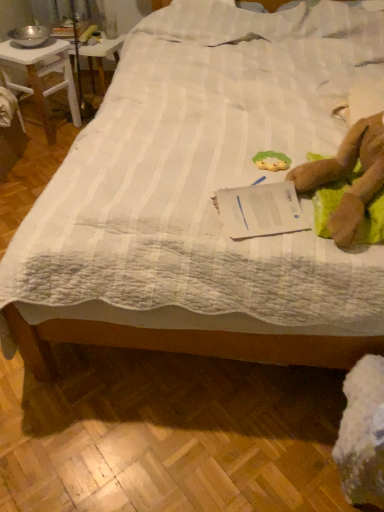
What are the coordinates of `metallic silver bowl at upper left` in the screenshot? It's located at (95, 58).

Find the location of a particular element. Image resolution: width=384 pixels, height=512 pixels. green fabric toy at center is located at coordinates (272, 161).

Find the location of a particular element. The height and width of the screenshot is (512, 384). white wood desk at upper left is located at coordinates (41, 77).

Consider the image. How different are the orientations of white paper at center and white quilted bed at center in degrees?

The angular difference between white paper at center and white quilted bed at center is 69 degrees.

From the image's perspective, which is below, white paper at center or white quilted bed at center?

white paper at center, from the image's perspective.

Is white paper at center completely or partially outside of white quilted bed at center?

No, most part of white paper at center lies within white quilted bed at center.

Considering the positions of objects white paper at center and white quilted bed at center in the image provided, who is more to the left, white paper at center or white quilted bed at center?

From the viewer's perspective, white paper at center appears more on the left side.

From a real-world perspective, which is physically above, white wood desk at upper left or white paper at center?

white paper at center is physically above.

Which of these two, white wood desk at upper left or white paper at center, is bigger?

white wood desk at upper left.

Is white wood desk at upper left at the left side of white paper at center?

Indeed, white wood desk at upper left is positioned on the left side of white paper at center.

Is point (50, 136) positioned after point (230, 237)?

Yes, point (50, 136) is behind point (230, 237).

Is metallic silver bowl at upper left shorter than white quilted bed at center?

Correct, metallic silver bowl at upper left is not as tall as white quilted bed at center.

In the scene shown: Is metallic silver bowl at upper left bigger or smaller than white quilted bed at center?

metallic silver bowl at upper left is smaller than white quilted bed at center.

Which is correct: metallic silver bowl at upper left is inside white quilted bed at center, or outside of it?

metallic silver bowl at upper left is located beyond the bounds of white quilted bed at center.

Find the location of `bed in front of the metallic silver bowl at upper left`. bed in front of the metallic silver bowl at upper left is located at coordinates (200, 199).

Considering the sizes of brown plush toy at right and white paper at center in the image, is brown plush toy at right bigger or smaller than white paper at center?

brown plush toy at right is bigger than white paper at center.

Is brown plush toy at right facing towards white paper at center?

No, brown plush toy at right is not oriented towards white paper at center.

Based on their sizes in the image, would you say white paper at center is bigger or smaller than metallic silver bowl at upper left?

Considering their sizes, white paper at center takes up less space than metallic silver bowl at upper left.

Is white paper at center closer to camera compared to metallic silver bowl at upper left?

Yes, it is.

Is white paper at center taller than metallic silver bowl at upper left?

No.

Would you consider white paper at center to be distant from metallic silver bowl at upper left?

Yes.

Is metallic silver bowl at upper left directly adjacent to green fabric toy at center?

No.

The height and width of the screenshot is (512, 384). I want to click on toy in front of the metallic silver bowl at upper left, so click(272, 161).

Considering the positions of objects metallic silver bowl at upper left and green fabric toy at center in the image provided, who is behind, metallic silver bowl at upper left or green fabric toy at center?

metallic silver bowl at upper left is further away from the camera.

Is metallic silver bowl at upper left taller than green fabric toy at center?

Correct, metallic silver bowl at upper left is much taller as green fabric toy at center.

Is the depth of white wood desk at upper left less than that of brown plush toy at right?

No.

Find the location of `desk that appears below the brown plush toy at right (from a real-world perspective)`. desk that appears below the brown plush toy at right (from a real-world perspective) is located at coordinates (41, 77).

Visually, is white wood desk at upper left positioned to the left or to the right of brown plush toy at right?

Based on their positions, white wood desk at upper left is located to the left of brown plush toy at right.

At what (x,y) coordinates should I click in order to perform the action: click on bed that is under the white paper at center (from a real-world perspective). Please return your answer as a coordinate pair (x, y). Looking at the image, I should click on (200, 199).

Identify the location of desk on the left side of white paper at center. This screenshot has height=512, width=384. (41, 77).

When comparing their distances from white paper at center, does white quilted bed at center or metallic silver bowl at upper left seem closer?

Based on the image, white quilted bed at center appears to be nearer to white paper at center.

Estimate the real-world distances between objects in this image. Which object is closer to white paper at center, brown plush toy at right or white wood desk at upper left?

brown plush toy at right is positioned closer to the anchor white paper at center.

When comparing their distances from metallic silver bowl at upper left, does white quilted bed at center or brown plush toy at right seem further?

brown plush toy at right.

Based on their spatial positions, is white quilted bed at center or white wood desk at upper left closer to white paper at center?

Among the two, white quilted bed at center is located nearer to white paper at center.

Based on their spatial positions, is metallic silver bowl at upper left or white paper at center further from white wood desk at upper left?

Based on the image, white paper at center appears to be further to white wood desk at upper left.

From the image, which object appears to be nearer to metallic silver bowl at upper left, white quilted bed at center or white wood desk at upper left?

white wood desk at upper left lies closer to metallic silver bowl at upper left than the other object.

From the image, which object appears to be nearer to white wood desk at upper left, white paper at center or metallic silver bowl at upper left?

Among the two, metallic silver bowl at upper left is located nearer to white wood desk at upper left.

From the image, which object appears to be farther from green fabric toy at center, white wood desk at upper left or white quilted bed at center?

white wood desk at upper left lies further to green fabric toy at center than the other object.

What are the coordinates of `paperback book between white wood desk at upper left and green fabric toy at center from left to right` in the screenshot? It's located at (260, 210).

Where is `table between white wood desk at upper left and green fabric toy at center in the horizontal direction`? The image size is (384, 512). table between white wood desk at upper left and green fabric toy at center in the horizontal direction is located at coordinates (95, 58).

Find the location of a particular element. This screenshot has height=512, width=384. person between white quilted bed at center and white paper at center from top to bottom is located at coordinates point(347,177).

The image size is (384, 512). In order to click on toy between brown plush toy at right and metallic silver bowl at upper left along the z-axis in this screenshot , I will do `click(272, 161)`.